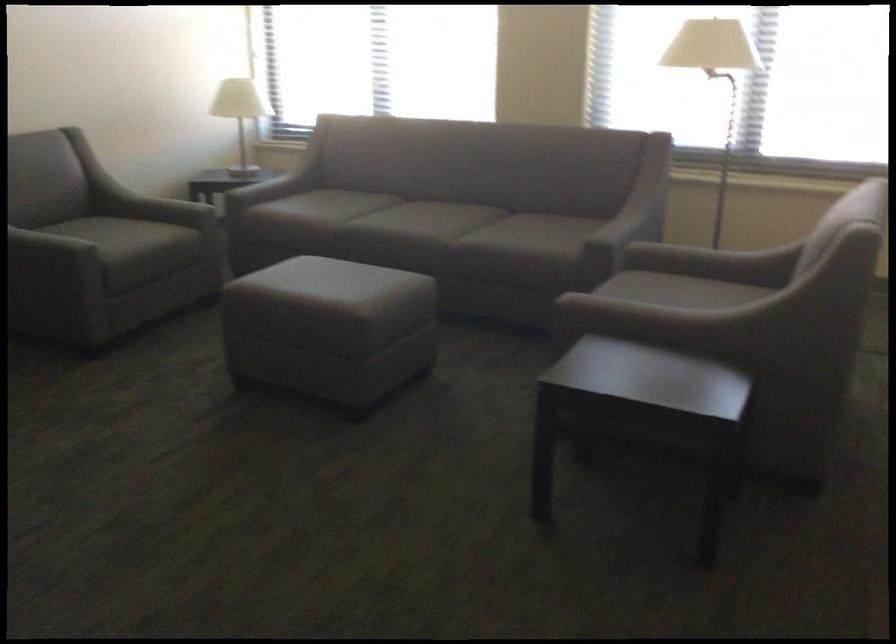
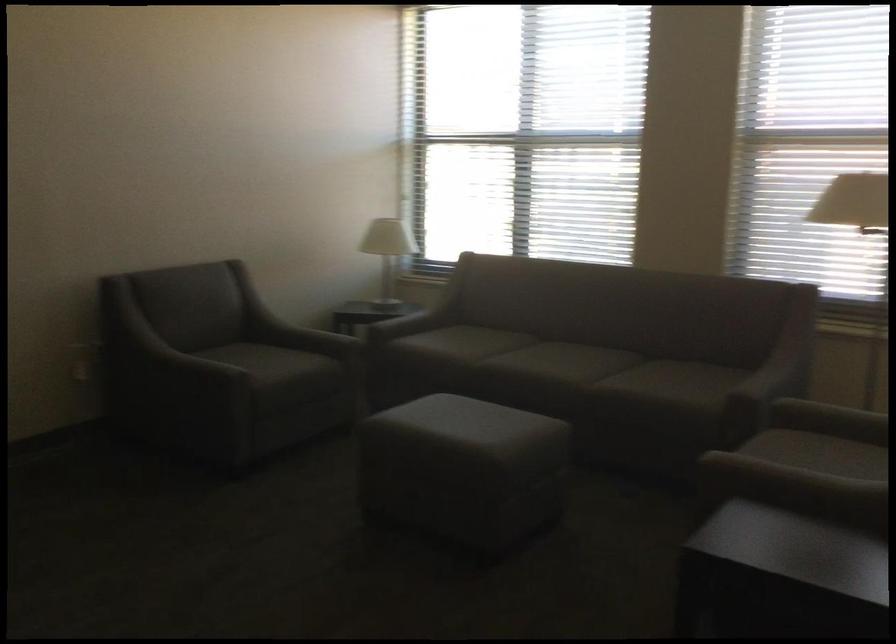
In the second image, find the point that corresponds to the point at 165,210 in the first image.

(307, 339)